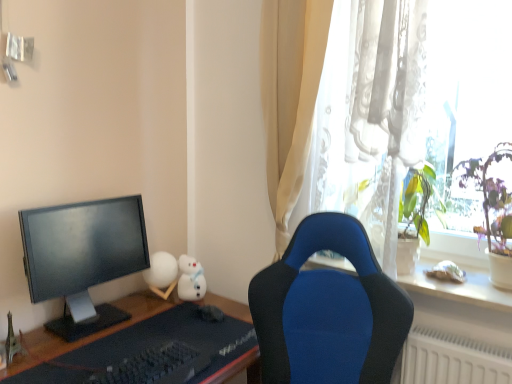
This screenshot has height=384, width=512. Describe the element at coordinates (447, 272) in the screenshot. I see `white plush toy at upper right, the second toy in the front-to-back sequence` at that location.

What do you see at coordinates (155, 366) in the screenshot?
I see `black matte keyboard at lower center` at bounding box center [155, 366].

Locate an element on the screen. The image size is (512, 384). matte black monitor at left is located at coordinates (82, 258).

Locate an element on the screen. white plush toy at upper right, which is the 1th toy in right-to-left order is located at coordinates (x=447, y=272).

How many degrees apart are the facing directions of matte black monitor at left and black matte keyboard at lower center?

The angle between the facing direction of matte black monitor at left and the facing direction of black matte keyboard at lower center is 1.18 degrees.

Is matte black monitor at left closer to the viewer compared to black matte keyboard at lower center?

No, the depth of matte black monitor at left is greater than that of black matte keyboard at lower center.

Is matte black monitor at left completely or partially outside of black matte keyboard at lower center?

Yes, matte black monitor at left is not within black matte keyboard at lower center.

Considering the points (73, 237) and (151, 382), which point is behind, point (73, 237) or point (151, 382)?

The point (73, 237) is farther.

Considering the sizes of objects black matte keyboard at lower center and green leafy plant at right in the image provided, who is wider, black matte keyboard at lower center or green leafy plant at right?

green leafy plant at right.

Is green leafy plant at right a part of black matte keyboard at lower center?

No, green leafy plant at right is located outside of black matte keyboard at lower center.

Are black matte keyboard at lower center and green leafy plant at right far apart?

Absolutely, black matte keyboard at lower center is distant from green leafy plant at right.

From a real-world perspective, who is located higher, black matte keyboard at lower center or green leafy plant at right?

green leafy plant at right.

Which of these two, metallic silver eiffel tower at lower left, positioned as the first toy in front-to-back order, or white plush toy at upper right, the third toy viewed from the back, is thinner?

metallic silver eiffel tower at lower left, positioned as the first toy in front-to-back order, is thinner.

Choose the correct answer: Is metallic silver eiffel tower at lower left, positioned as the first toy in front-to-back order, inside white plush toy at upper right, the fourth toy in the left-to-right sequence, or outside it?

metallic silver eiffel tower at lower left, positioned as the first toy in front-to-back order, is located beyond the bounds of white plush toy at upper right, the fourth toy in the left-to-right sequence.

From the image's perspective, is metallic silver eiffel tower at lower left, positioned as the first toy in front-to-back order, positioned above or below white plush toy at upper right, which is the 1th toy in right-to-left order?

From the image's perspective, metallic silver eiffel tower at lower left, positioned as the first toy in front-to-back order, appears below white plush toy at upper right, which is the 1th toy in right-to-left order.

From a real-world perspective, does metallic silver eiffel tower at lower left, placed as the 4th toy when sorted from right to left, sit lower than white plush toy at upper right, the second toy in the front-to-back sequence?

Yes, from a real-world perspective, metallic silver eiffel tower at lower left, placed as the 4th toy when sorted from right to left, is beneath white plush toy at upper right, the second toy in the front-to-back sequence.

Does point (182, 383) appear closer or farther from the camera than point (201, 287)?

Clearly, point (182, 383) is closer to the camera than point (201, 287).

Is the surface of black matte keyboard at lower center in direct contact with white matte plush toy at center, marked as the second toy in a back-to-front arrangement?

black matte keyboard at lower center and white matte plush toy at center, marked as the second toy in a back-to-front arrangement, are not in contact.

Does black matte keyboard at lower center appear on the right side of white matte plush toy at center, marked as the second toy in a back-to-front arrangement?

Incorrect, black matte keyboard at lower center is not on the right side of white matte plush toy at center, marked as the second toy in a back-to-front arrangement.

Between black matte keyboard at lower center and white matte plush toy at center, which is the second toy from right to left, which one has more height?

Standing taller between the two is white matte plush toy at center, which is the second toy from right to left.

Between point (464, 179) and point (143, 360), which one is positioned in front?

The point (143, 360) is more forward.

Is green leafy plant at right inside or outside of black matte keyboard at lower center?

green leafy plant at right cannot be found inside black matte keyboard at lower center.

Measure the distance between green leafy plant at right and black matte keyboard at lower center.

green leafy plant at right is 1.04 meters from black matte keyboard at lower center.

From the image's perspective, is green leafy plant at right over black matte keyboard at lower center?

Correct, green leafy plant at right appears higher than black matte keyboard at lower center in the image.

Measure the distance between white matte sphere at center-left, the second toy when ordered from left to right, and metallic silver eiffel tower at lower left, placed as the 4th toy when sorted from right to left.

22.03 inches.

Considering the points (165, 280) and (13, 338), which point is behind, point (165, 280) or point (13, 338)?

The point (165, 280) is farther.

The width and height of the screenshot is (512, 384). I want to click on the 2nd toy below the white matte sphere at center-left, placed as the 3th toy when sorted from right to left (from the image's perspective), so click(x=13, y=342).

From a real-world perspective, which object stands above the other?

white matte sphere at center-left, which is the first toy from back to front.

Does point (439, 268) lie behind point (203, 366)?

Yes, it is behind point (203, 366).

Do you think white plush toy at upper right, which is the 1th toy in right-to-left order, is within black matte keyboard at lower center, or outside of it?

white plush toy at upper right, which is the 1th toy in right-to-left order, is not enclosed by black matte keyboard at lower center.

Which object is more forward, white plush toy at upper right, the fourth toy in the left-to-right sequence, or black matte keyboard at lower center?

black matte keyboard at lower center is closer to the camera.

Can you confirm if white plush toy at upper right, the fourth toy in the left-to-right sequence, is wider than black matte keyboard at lower center?

No.

At what (x,y) coordinates should I click in order to perform the action: click on keyboard below the matte black monitor at left (from the image's perspective). Please return your answer as a coordinate pair (x, y). The width and height of the screenshot is (512, 384). Looking at the image, I should click on (155, 366).

You are a GUI agent. You are given a task and a screenshot of the screen. Output one action in this format:
    pyautogui.click(x=<x>, y=<y>)
    Task: Click on the plant on the right side of black matte keyboard at lower center
    
    Given the screenshot: What is the action you would take?
    pyautogui.click(x=490, y=197)

Based on their spatial positions, is black matte keyboard at lower center or metallic silver eiffel tower at lower left, which is counted as the 4th toy, starting from the back, closer to green leafy plant at right?

black matte keyboard at lower center.

From the image, which object appears to be nearer to black matte keyboard at lower center, white matte sphere at center-left, positioned as the 4th toy in front-to-back order, or green leafy plant at right?

The object closer to black matte keyboard at lower center is white matte sphere at center-left, positioned as the 4th toy in front-to-back order.

From the image, which object appears to be nearer to white matte sphere at center-left, the second toy when ordered from left to right, green leafy plant at right or black matte keyboard at lower center?

Based on the image, black matte keyboard at lower center appears to be nearer to white matte sphere at center-left, the second toy when ordered from left to right.

When comparing their distances from white matte plush toy at center, marked as the second toy in a back-to-front arrangement, does black matte desk at lower left or white matte sphere at center-left, the second toy when ordered from left to right, seem further?

black matte desk at lower left.

Estimate the real-world distances between objects in this image. Which object is closer to white matte plush toy at center, which ranks as the 3th toy in front-to-back order, metallic silver eiffel tower at lower left, positioned as the first toy in front-to-back order, or green leafy plant at right?

Based on the image, metallic silver eiffel tower at lower left, positioned as the first toy in front-to-back order, appears to be nearer to white matte plush toy at center, which ranks as the 3th toy in front-to-back order.

Based on their spatial positions, is white plush toy at upper right, the second toy in the front-to-back sequence, or black matte keyboard at lower center further from black matte desk at lower left?

white plush toy at upper right, the second toy in the front-to-back sequence.

Considering their positions, is black matte keyboard at lower center positioned further to white matte sphere at center-left, the second toy when ordered from left to right, than white plush toy at upper right, the third toy viewed from the back?

white plush toy at upper right, the third toy viewed from the back.

In the scene shown: From the image, which object appears to be farther from matte black monitor at left, black matte keyboard at lower center or white matte sphere at center-left, the second toy when ordered from left to right?

black matte keyboard at lower center is further to matte black monitor at left.

At what (x,y) coordinates should I click in order to perform the action: click on desk between black matte keyboard at lower center and matte black monitor at left from front to back. Please return your answer as a coordinate pair (x, y). Image resolution: width=512 pixels, height=384 pixels. Looking at the image, I should click on tap(143, 343).

Locate an element on the screen. desk between matte black monitor at left and green leafy plant at right is located at coordinates (143, 343).

Where is `computer monitor between black matte keyboard at lower center and white matte sphere at center-left, positioned as the 4th toy in front-to-back order, in the front-back direction`? The width and height of the screenshot is (512, 384). computer monitor between black matte keyboard at lower center and white matte sphere at center-left, positioned as the 4th toy in front-to-back order, in the front-back direction is located at coordinates tap(82, 258).

I want to click on computer monitor between metallic silver eiffel tower at lower left, placed as the 4th toy when sorted from right to left, and white plush toy at upper right, the third toy viewed from the back, in the horizontal direction, so click(82, 258).